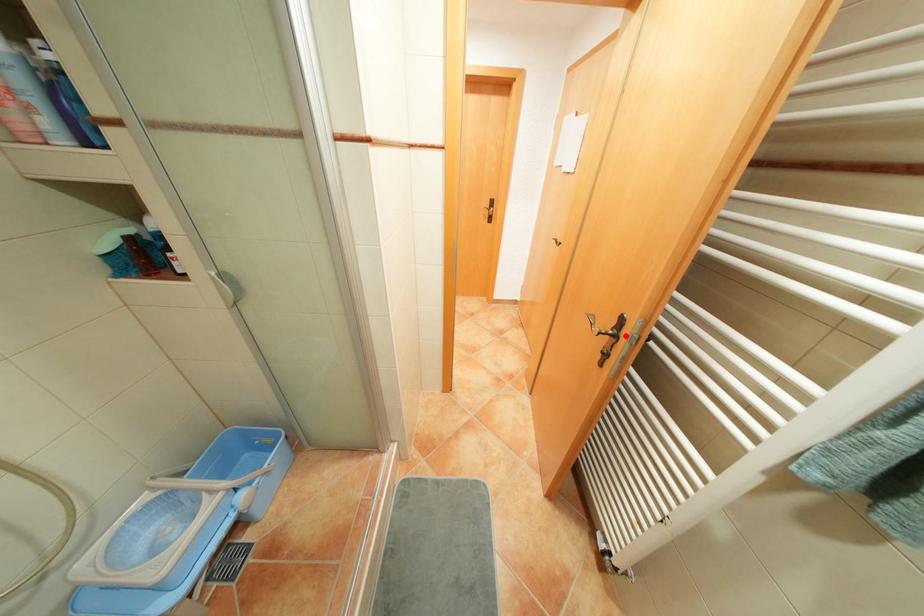
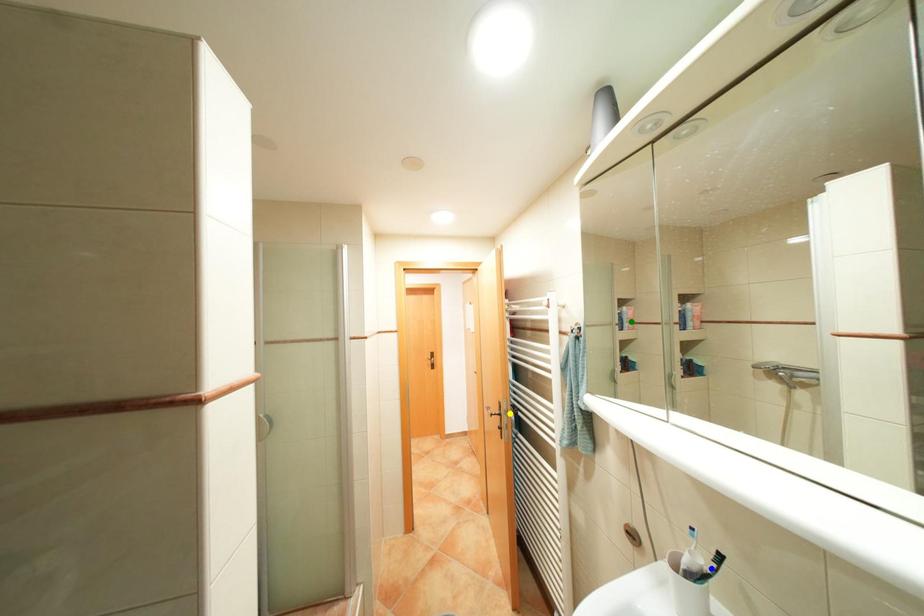
Question: I am providing you with two images of the same scene from different viewpoints. A red point is marked on the first image. You are given multiple points on the second image. Which spot in image 2 lines up with the point in image 1?

Choices:
 (A) green point
 (B) blue point
 (C) yellow point

Answer: (C)